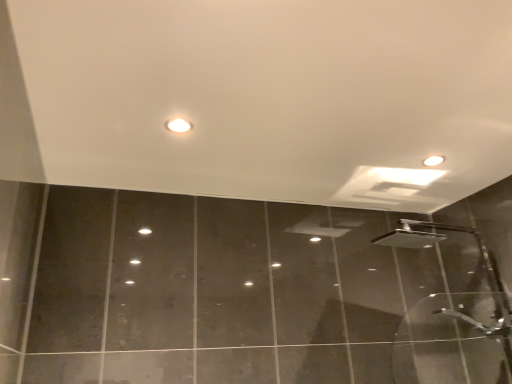
Describe the element at coordinates (482, 259) in the screenshot. This screenshot has height=384, width=512. I see `silver metallic shower head at right` at that location.

Find the location of a particular element. This screenshot has height=384, width=512. silver metallic shower head at right is located at coordinates (482, 259).

Find the location of a particular element. Image resolution: width=512 pixels, height=384 pixels. matte white droplight at upper center is located at coordinates (178, 125).

The image size is (512, 384). What do you see at coordinates (178, 125) in the screenshot? I see `matte white droplight at upper center` at bounding box center [178, 125].

The width and height of the screenshot is (512, 384). What are the coordinates of `silver metallic shower head at right` in the screenshot? It's located at point(482,259).

Does silver metallic shower head at right appear on the right side of matte white droplight at upper center?

→ Yes, silver metallic shower head at right is to the right of matte white droplight at upper center.

Is the depth of silver metallic shower head at right greater than that of matte white droplight at upper center?

Yes, the depth of silver metallic shower head at right is greater than that of matte white droplight at upper center.

Considering the positions of point (489, 331) and point (185, 129), is point (489, 331) closer or farther from the camera than point (185, 129)?

Clearly, point (489, 331) is more distant from the camera than point (185, 129).

From the image's perspective, relative to matte white droplight at upper center, is silver metallic shower head at right above or below?

Clearly, from the image's perspective, silver metallic shower head at right is below matte white droplight at upper center.

From a real-world perspective, is silver metallic shower head at right located beneath matte white droplight at upper center?

Indeed, from a real-world perspective, silver metallic shower head at right is positioned beneath matte white droplight at upper center.

Is silver metallic shower head at right wider or thinner than matte white droplight at upper center?

Considering their sizes, silver metallic shower head at right looks broader than matte white droplight at upper center.

Does silver metallic shower head at right have a greater height compared to matte white droplight at upper center?

Yes, silver metallic shower head at right is taller than matte white droplight at upper center.

Is silver metallic shower head at right smaller than matte white droplight at upper center?

Incorrect, silver metallic shower head at right is not smaller in size than matte white droplight at upper center.

Is silver metallic shower head at right positioned beyond the bounds of matte white droplight at upper center?

Yes.

Is silver metallic shower head at right far from matte white droplight at upper center?

Yes, silver metallic shower head at right and matte white droplight at upper center are located far from each other.

Is silver metallic shower head at right looking in the opposite direction of matte white droplight at upper center?

No.

At what (x,y) coordinates should I click in order to perform the action: click on shower that appears below the matte white droplight at upper center (from the image's perspective). Please return your answer as a coordinate pair (x, y). The height and width of the screenshot is (384, 512). Looking at the image, I should click on (482, 259).

Is matte white droplight at upper center to the left or to the right of silver metallic shower head at right in the image?

Based on their positions, matte white droplight at upper center is located to the left of silver metallic shower head at right.

Consider the image. Is the position of matte white droplight at upper center less distant than that of silver metallic shower head at right?

Yes, it is in front of silver metallic shower head at right.

Considering the positions of point (181, 119) and point (511, 332), is point (181, 119) closer or farther from the camera than point (511, 332)?

Point (181, 119).

From the image's perspective, is matte white droplight at upper center below silver metallic shower head at right?

Actually, matte white droplight at upper center appears above silver metallic shower head at right in the image.

From a real-world perspective, is matte white droplight at upper center located higher than silver metallic shower head at right?

Yes, from a real-world perspective, matte white droplight at upper center is above silver metallic shower head at right.

Which object is wider, matte white droplight at upper center or silver metallic shower head at right?

silver metallic shower head at right.

Is matte white droplight at upper center shorter than silver metallic shower head at right?

Correct, matte white droplight at upper center is not as tall as silver metallic shower head at right.

Considering the relative sizes of matte white droplight at upper center and silver metallic shower head at right in the image provided, is matte white droplight at upper center smaller than silver metallic shower head at right?

Yes.

Is matte white droplight at upper center not within silver metallic shower head at right?

Absolutely, matte white droplight at upper center is external to silver metallic shower head at right.

Would you consider matte white droplight at upper center to be distant from silver metallic shower head at right?

Yes, matte white droplight at upper center and silver metallic shower head at right are located far from each other.

Could you tell me if matte white droplight at upper center is facing silver metallic shower head at right?

No.

The width and height of the screenshot is (512, 384). Find the location of `droplight lying on the left of silver metallic shower head at right`. droplight lying on the left of silver metallic shower head at right is located at coordinates coord(178,125).

This screenshot has width=512, height=384. Identify the location of shower below the matte white droplight at upper center (from the image's perspective). (482, 259).

At what (x,y) coordinates should I click in order to perform the action: click on shower on the right of matte white droplight at upper center. Please return your answer as a coordinate pair (x, y). Looking at the image, I should click on (482, 259).